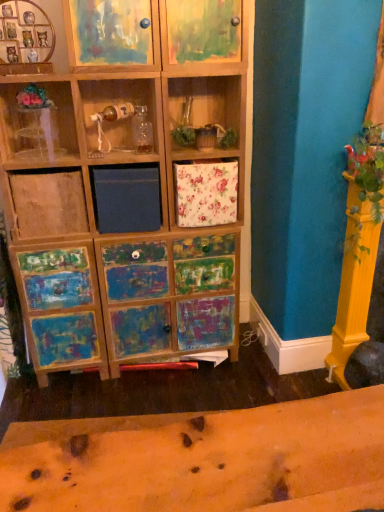
Question: Are transparent plastic vase at upper left and painted wood cabinet at upper left, marked as the 2th cabinet in a right-to-left arrangement, making contact?

Choices:
 (A) no
 (B) yes

Answer: (A)

Question: Considering the relative sizes of transparent plastic vase at upper left and painted wood cabinet at upper left, marked as the 2th cabinet in a right-to-left arrangement, in the image provided, is transparent plastic vase at upper left wider than painted wood cabinet at upper left, marked as the 2th cabinet in a right-to-left arrangement,?

Choices:
 (A) yes
 (B) no

Answer: (B)

Question: Is transparent plastic vase at upper left thinner than painted wood cabinet at upper left, marked as the 2th cabinet in a right-to-left arrangement?

Choices:
 (A) no
 (B) yes

Answer: (B)

Question: From the image's perspective, is transparent plastic vase at upper left above painted wood cabinet at upper left, marked as the 2th cabinet in a right-to-left arrangement?

Choices:
 (A) no
 (B) yes

Answer: (A)

Question: From the image's perspective, is transparent plastic vase at upper left beneath painted wood cabinet at upper left, marked as the 2th cabinet in a right-to-left arrangement?

Choices:
 (A) yes
 (B) no

Answer: (A)

Question: Considering the positions of painted wood cabinet at upper center, the first cabinet from the right, and painted wood cabinet at upper left, the 1th cabinet viewed from the left, in the image, is painted wood cabinet at upper center, the first cabinet from the right, bigger or smaller than painted wood cabinet at upper left, the 1th cabinet viewed from the left,?

Choices:
 (A) small
 (B) big

Answer: (B)

Question: Choose the correct answer: Is painted wood cabinet at upper center, the first cabinet from the right, inside painted wood cabinet at upper left, marked as the 2th cabinet in a right-to-left arrangement, or outside it?

Choices:
 (A) outside
 (B) inside

Answer: (A)

Question: Is painted wood cabinet at upper center, the 2th cabinet positioned from the left, in front of or behind painted wood cabinet at upper left, the 1th cabinet viewed from the left, in the image?

Choices:
 (A) front
 (B) behind

Answer: (B)

Question: In the image, is painted wood cabinet at upper center, the first cabinet from the right, on the left side or the right side of painted wood cabinet at upper left, the 1th cabinet viewed from the left?

Choices:
 (A) left
 (B) right

Answer: (B)

Question: From a real-world perspective, relative to transparent plastic vase at upper left, is painted wood cabinet at upper left, marked as the 2th cabinet in a right-to-left arrangement, vertically above or below?

Choices:
 (A) above
 (B) below

Answer: (A)

Question: In terms of size, does painted wood cabinet at upper left, the 1th cabinet viewed from the left, appear bigger or smaller than transparent plastic vase at upper left?

Choices:
 (A) big
 (B) small

Answer: (A)

Question: Is painted wood cabinet at upper left, marked as the 2th cabinet in a right-to-left arrangement, wider or thinner than transparent plastic vase at upper left?

Choices:
 (A) thin
 (B) wide

Answer: (B)

Question: Is painted wood cabinet at upper left, the 1th cabinet viewed from the left, in front of or behind transparent plastic vase at upper left in the image?

Choices:
 (A) front
 (B) behind

Answer: (A)

Question: From a real-world perspective, is painted wood cabinet at upper left, marked as the 2th cabinet in a right-to-left arrangement, above or below painted wood cabinet at upper center, the 2th cabinet positioned from the left?

Choices:
 (A) below
 (B) above

Answer: (B)

Question: Is painted wood cabinet at upper left, marked as the 2th cabinet in a right-to-left arrangement, spatially inside painted wood cabinet at upper center, the first cabinet from the right, or outside of it?

Choices:
 (A) outside
 (B) inside

Answer: (A)